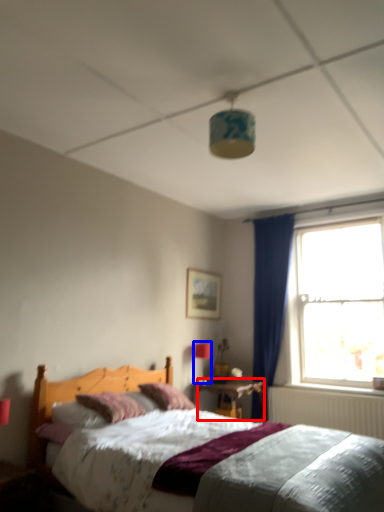
Question: Which of the following is the closest to the observer, nightstand (highlighted by a red box) or light fixture (highlighted by a blue box)?

Choices:
 (A) nightstand
 (B) light fixture

Answer: (A)